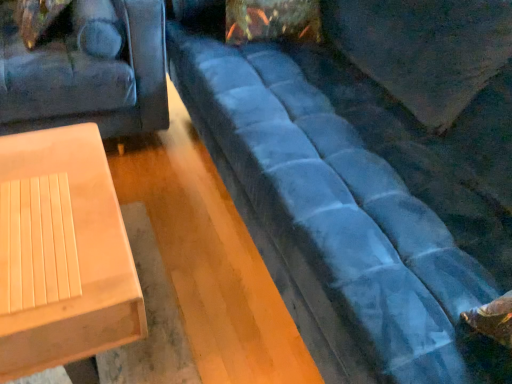
Question: Is light wood/texture table at lower left oriented towards velvet blue couch at center?

Choices:
 (A) no
 (B) yes

Answer: (A)

Question: Does light wood/texture table at lower left appear on the right side of velvet blue couch at center?

Choices:
 (A) yes
 (B) no

Answer: (B)

Question: Is light wood/texture table at lower left in front of velvet blue couch at center?

Choices:
 (A) yes
 (B) no

Answer: (B)

Question: From the image's perspective, is light wood/texture table at lower left on top of velvet blue couch at center?

Choices:
 (A) yes
 (B) no

Answer: (B)

Question: Can you see light wood/texture table at lower left touching velvet blue couch at center?

Choices:
 (A) yes
 (B) no

Answer: (B)

Question: Is light wood/texture table at lower left outside velvet blue couch at center?

Choices:
 (A) no
 (B) yes

Answer: (B)

Question: Is light wood/texture table at lower left inside velvet blue couch at center?

Choices:
 (A) yes
 (B) no

Answer: (B)

Question: From a real-world perspective, is velvet blue couch at center below light wood/texture table at lower left?

Choices:
 (A) no
 (B) yes

Answer: (A)

Question: Is velvet blue couch at center thinner than light wood/texture table at lower left?

Choices:
 (A) yes
 (B) no

Answer: (B)

Question: Does velvet blue couch at center have a larger size compared to light wood/texture table at lower left?

Choices:
 (A) yes
 (B) no

Answer: (A)

Question: Is velvet blue couch at center wider than light wood/texture table at lower left?

Choices:
 (A) no
 (B) yes

Answer: (B)

Question: Are velvet blue couch at center and light wood/texture table at lower left making contact?

Choices:
 (A) yes
 (B) no

Answer: (B)

Question: Is point (95, 140) closer or farther from the camera than point (224, 96)?

Choices:
 (A) closer
 (B) farther

Answer: (A)